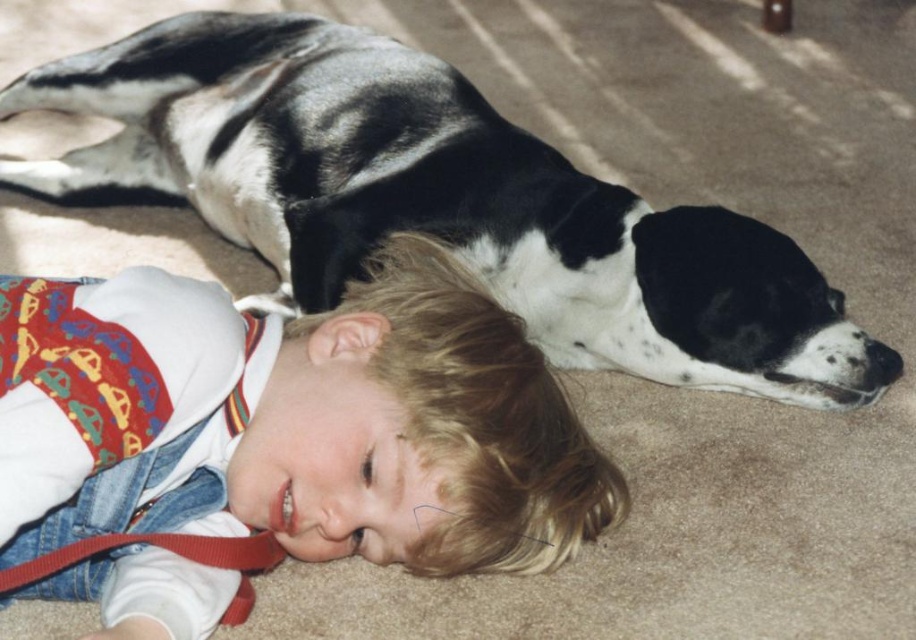
Does denim overalls at lower left appear on the left side of black and white fur dog at upper center?

Correct, you'll find denim overalls at lower left to the left of black and white fur dog at upper center.

Based on the photo, does denim overalls at lower left appear under black and white fur dog at upper center?

Indeed, denim overalls at lower left is positioned under black and white fur dog at upper center.

Where is `denim overalls at lower left`? The image size is (916, 640). denim overalls at lower left is located at coordinates (292, 420).